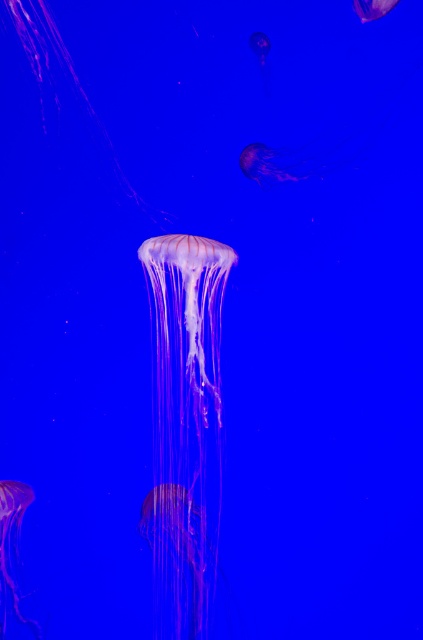
Is translucent pink jellyfish at center shorter than translucent purple jellyfish at center?

No.

Who is more distant from viewer, (194, 260) or (247, 173)?

Point (247, 173)

Find the location of a particular element. translucent pink jellyfish at center is located at coordinates (184, 426).

Is translucent purple jellyfish at center thinner than translucent purple jellyfish at upper right?

In fact, translucent purple jellyfish at center might be wider than translucent purple jellyfish at upper right.

Does translucent purple jellyfish at center have a smaller size compared to translucent purple jellyfish at upper right?

Incorrect, translucent purple jellyfish at center is not smaller in size than translucent purple jellyfish at upper right.

What do you see at coordinates (274, 164) in the screenshot? I see `translucent purple jellyfish at center` at bounding box center [274, 164].

Identify the location of translucent purple jellyfish at center. This screenshot has width=423, height=640. (274, 164).

Does translucent pink jellyfish at lower left have a lesser width compared to translucent pink jellyfish at upper center?

No, translucent pink jellyfish at lower left is not thinner than translucent pink jellyfish at upper center.

Does translucent pink jellyfish at lower left appear under translucent pink jellyfish at upper center?

Yes.

Describe the element at coordinates (13, 547) in the screenshot. I see `translucent pink jellyfish at lower left` at that location.

The width and height of the screenshot is (423, 640). I want to click on translucent pink jellyfish at lower left, so (x=13, y=547).